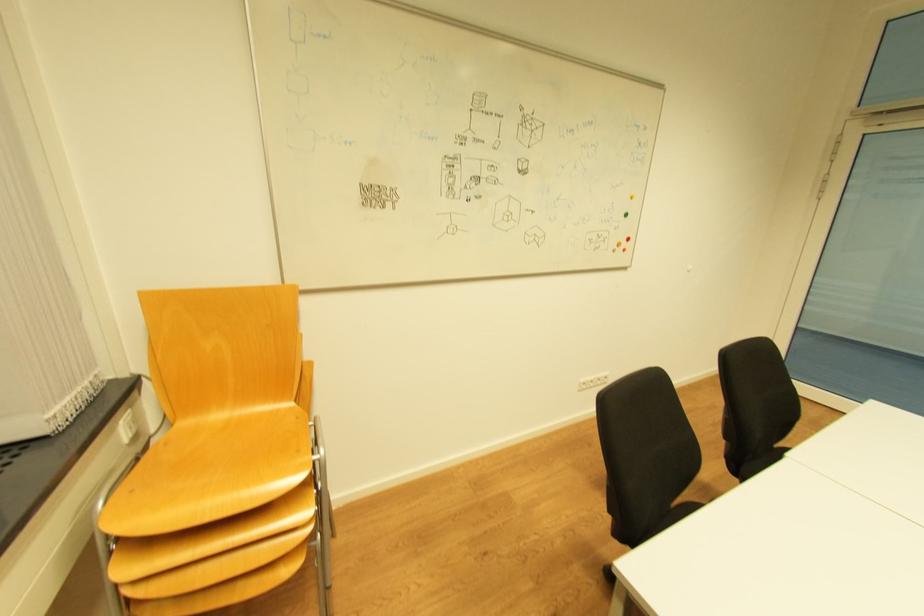
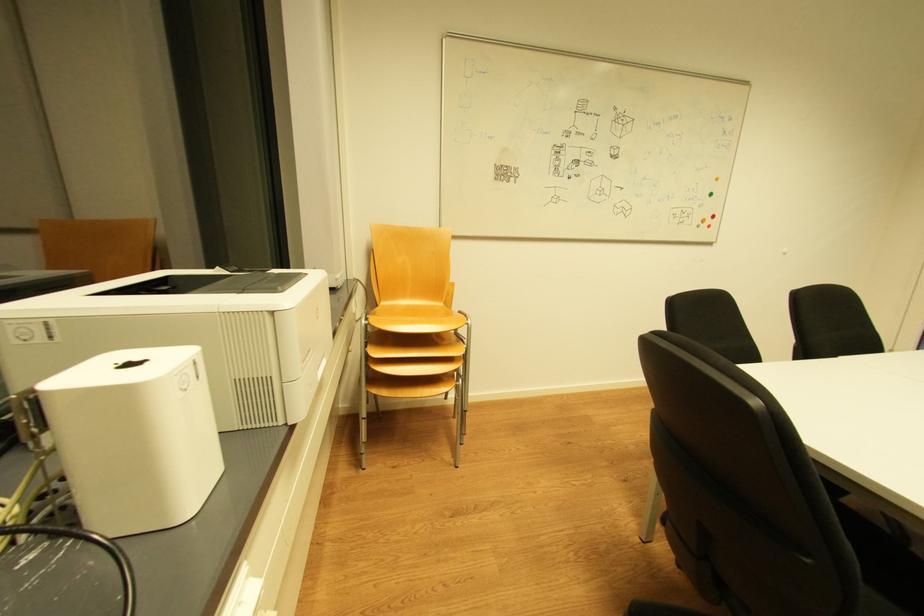
Question: The images are taken continuously from a first-person perspective. In which direction are you moving?

Choices:
 (A) Left
 (B) Right
 (C) Forward
 (D) Backward

Answer: (D)